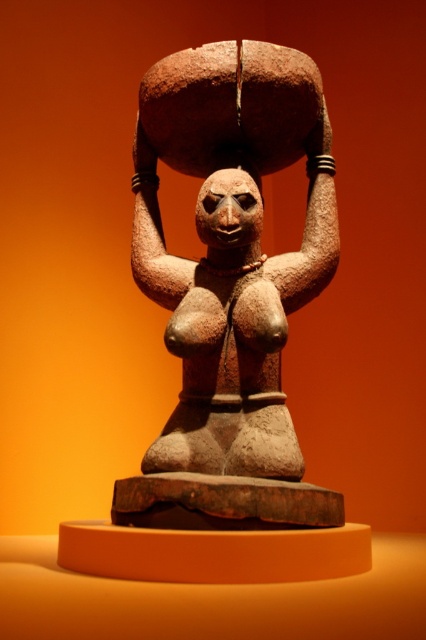
You are an archaeologist examining the stone figure. You notice two points marked on the figure. The first point is at coordinates point [221,211] and the second is at point [255,216]. Based on their positions, which point is closer to you?

Point [221,211] is in front of point [255,216], so it is closer to you.

You are standing in front of the carved stone figure described in the scene. There is a point at coordinates point (230, 285). Where is this point located?

The point (230, 285) is on the brown stone statue at center.

You are an art conservator examining the brown stone statue at center and the matte brown head at center. Which object would require a larger storage space when packing for transport?

The brown stone statue at center is bigger than the matte brown head at center, so it would require a larger storage space when packing for transport.